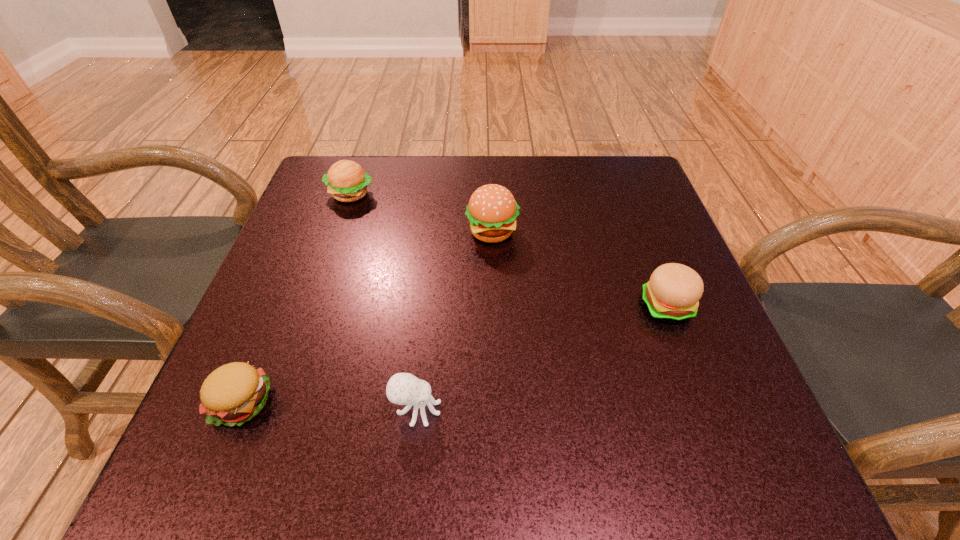
Find the location of a particular element. The image size is (960, 540). vacant area between the shortest object and the third object from right to left is located at coordinates (329, 406).

At what (x,y) coordinates should I click in order to perform the action: click on vacant point located between the farthest hamburger and the shortest object. Please return your answer as a coordinate pair (x, y). The height and width of the screenshot is (540, 960). Looking at the image, I should click on (296, 298).

Find the location of a particular element. blank region between the farthest object and the second nearest hamburger is located at coordinates (509, 251).

At what (x,y) coordinates should I click in order to perform the action: click on free space between the octopus and the third nearest hamburger. Please return your answer as a coordinate pair (x, y). This screenshot has height=540, width=960. Looking at the image, I should click on (454, 320).

The height and width of the screenshot is (540, 960). Identify the location of unoccupied area between the farthest object and the rightmost hamburger. (509, 251).

Where is `empty space between the third object from right to left and the second farthest object`? This screenshot has width=960, height=540. empty space between the third object from right to left and the second farthest object is located at coordinates (454, 320).

Where is `empty space that is in between the second farthest hamburger and the shortest object`? The height and width of the screenshot is (540, 960). empty space that is in between the second farthest hamburger and the shortest object is located at coordinates (367, 317).

This screenshot has width=960, height=540. What are the coordinates of `object that stands as the fourth closest to the third object from right to left` in the screenshot? It's located at (347, 182).

Where is `object that is the second nearest to the rightmost object`? This screenshot has height=540, width=960. object that is the second nearest to the rightmost object is located at coordinates (403, 388).

Select which hamburger appears as the fourth closest to the octopus. Please provide its 2D coordinates. Your answer should be formatted as a tuple, i.e. [(x, y)], where the tuple contains the x and y coordinates of a point satisfying the conditions above.

[(347, 182)]